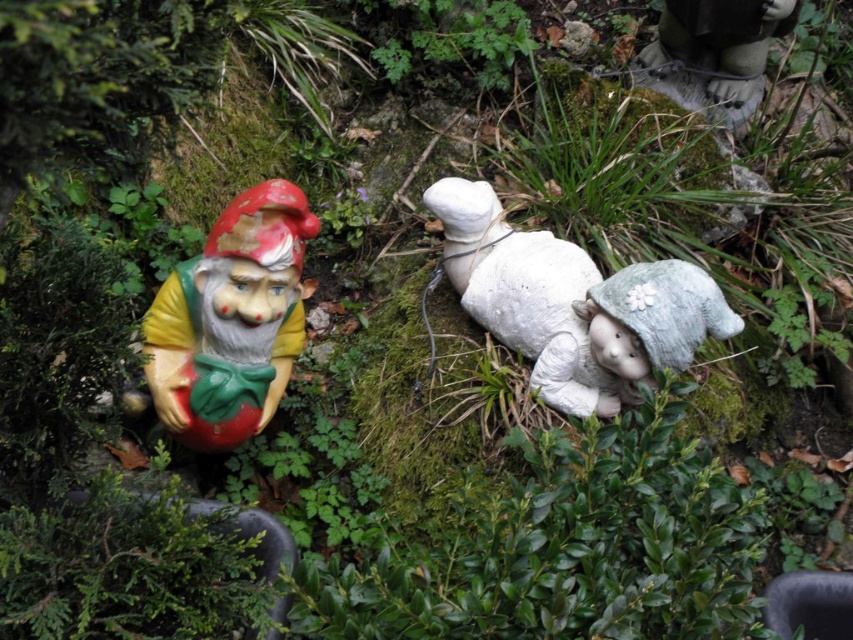
Question: Is matte plastic gnome at left wider than white matte stone gnome at center?

Choices:
 (A) no
 (B) yes

Answer: (A)

Question: Is matte plastic gnome at left to the right of white matte stone gnome at center from the viewer's perspective?

Choices:
 (A) no
 (B) yes

Answer: (A)

Question: Which of the following is the closest to the observer?

Choices:
 (A) white matte stone gnome at center
 (B) matte plastic gnome at left

Answer: (B)

Question: In this image, where is matte plastic gnome at left located relative to white matte stone gnome at center?

Choices:
 (A) above
 (B) below

Answer: (B)